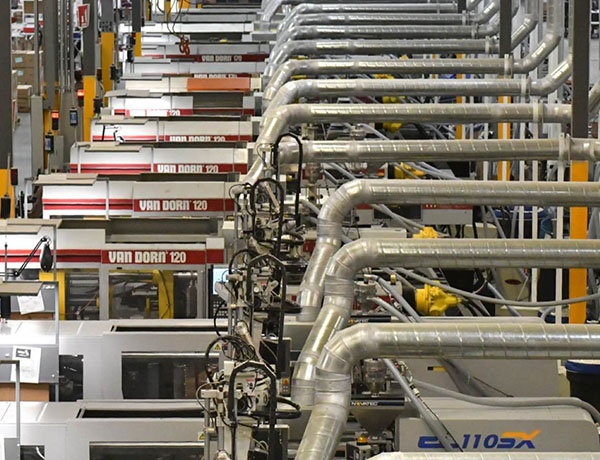
The width and height of the screenshot is (600, 460). I want to click on windows, so click(183, 296), click(97, 302), click(168, 380).